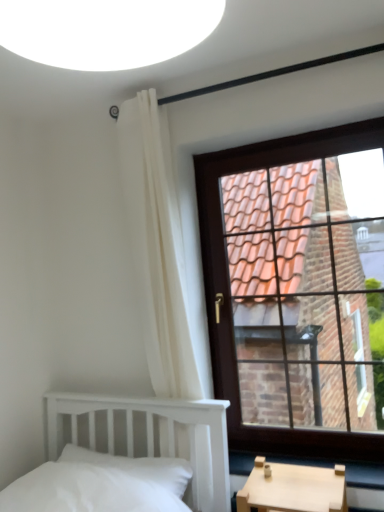
This screenshot has width=384, height=512. Identify the location of brown wooden window at upper right. (291, 294).

Image resolution: width=384 pixels, height=512 pixels. Describe the element at coordinates (137, 467) in the screenshot. I see `white soft pillow at lower left` at that location.

In order to click on white fabric curtain at upper left in this screenshot , I will do `click(157, 246)`.

Does white soft pillow at lower left have a smaller size compared to white fabric curtain at upper left?

Yes, white soft pillow at lower left is smaller than white fabric curtain at upper left.

This screenshot has height=512, width=384. Find the location of `curtain above the white soft pillow at lower left (from the image's perspective)`. curtain above the white soft pillow at lower left (from the image's perspective) is located at coordinates (157, 246).

From a real-world perspective, is white soft pillow at lower left below white fabric curtain at upper left?

Yes, from a real-world perspective, white soft pillow at lower left is beneath white fabric curtain at upper left.

Are brown wooden window at upper right and white soft pillow at lower left beside each other?

No.

Is brown wooden window at upper right oriented towards white soft pillow at lower left?

No, brown wooden window at upper right is not aimed at white soft pillow at lower left.

Does brown wooden window at upper right have a lesser width compared to white soft pillow at lower left?

Correct, the width of brown wooden window at upper right is less than that of white soft pillow at lower left.

From the picture: How different are the orientations of brown wooden window at upper right and white soft pillow at lower left in degrees?

They differ by 0.52 degrees in their facing directions.

From the picture: Is white fabric curtain at upper left spatially inside brown wooden window at upper right, or outside of it?

white fabric curtain at upper left is not enclosed by brown wooden window at upper right.

Which is in front, point (120, 134) or point (364, 352)?

The point (120, 134) is closer to the camera.

Is white fabric curtain at upper left looking in the opposite direction of brown wooden window at upper right?

That's not correct — white fabric curtain at upper left is not looking away from brown wooden window at upper right.

Considering the sizes of objects white fabric curtain at upper left and brown wooden window at upper right in the image provided, who is thinner, white fabric curtain at upper left or brown wooden window at upper right?

Thinner between the two is brown wooden window at upper right.

Between white soft pillow at lower left and brown wooden window at upper right, which one has larger size?

Bigger between the two is brown wooden window at upper right.

Is brown wooden window at upper right located within white soft pillow at lower left?

Definitely not — brown wooden window at upper right is not inside white soft pillow at lower left.

From a real-world perspective, is white soft pillow at lower left on brown wooden window at upper right?

Incorrect, from a real-world perspective, white soft pillow at lower left is lower than brown wooden window at upper right.

This screenshot has height=512, width=384. Identify the location of window above the white fabric curtain at upper left (from the image's perspective). (291, 294).

Would you say white fabric curtain at upper left is part of brown wooden window at upper right's contents?

Definitely not — white fabric curtain at upper left is not inside brown wooden window at upper right.

Is the position of brown wooden window at upper right less distant than that of white fabric curtain at upper left?

No, brown wooden window at upper right is further to the viewer.

Is white fabric curtain at upper left shorter than white soft pillow at lower left?

No.

Is white fabric curtain at upper left at the right side of white soft pillow at lower left?

Correct, you'll find white fabric curtain at upper left to the right of white soft pillow at lower left.

Is white fabric curtain at upper left bigger than white soft pillow at lower left?

Yes, white fabric curtain at upper left is bigger than white soft pillow at lower left.

Does point (177, 365) come in front of point (160, 479)?

No, it is not.

The width and height of the screenshot is (384, 512). I want to click on curtain that is above the white soft pillow at lower left (from a real-world perspective), so click(x=157, y=246).

Identify the location of window on the right side of white soft pillow at lower left. (291, 294).

Estimate the real-world distances between objects in this image. Which object is closer to white fabric curtain at upper left, brown wooden window at upper right or white soft pillow at lower left?

white soft pillow at lower left is closer to white fabric curtain at upper left.

Estimate the real-world distances between objects in this image. Which object is closer to white soft pillow at lower left, brown wooden window at upper right or white fabric curtain at upper left?

Based on the image, white fabric curtain at upper left appears to be nearer to white soft pillow at lower left.

Which object lies nearer to the anchor point white fabric curtain at upper left, white soft pillow at lower left or brown wooden window at upper right?

white soft pillow at lower left is closer to white fabric curtain at upper left.

Considering their positions, is white fabric curtain at upper left positioned further to brown wooden window at upper right than white soft pillow at lower left?

white soft pillow at lower left is further to brown wooden window at upper right.

From the image, which object appears to be farther from brown wooden window at upper right, white soft pillow at lower left or white fabric curtain at upper left?

Among the two, white soft pillow at lower left is located further to brown wooden window at upper right.

Estimate the real-world distances between objects in this image. Which object is further from white soft pillow at lower left, white fabric curtain at upper left or brown wooden window at upper right?

Based on the image, brown wooden window at upper right appears to be further to white soft pillow at lower left.

In order to click on curtain between white soft pillow at lower left and brown wooden window at upper right in the horizontal direction in this screenshot , I will do `click(157, 246)`.